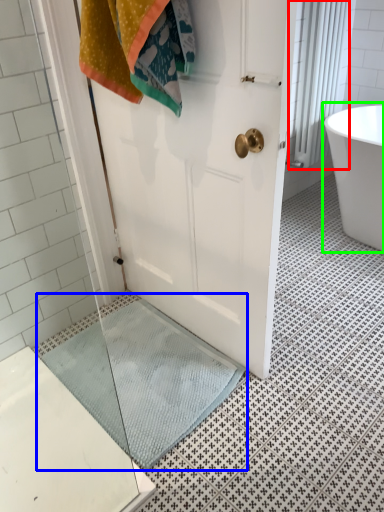
Question: Which object is the farthest from shower curtain (highlighted by a red box)? Choose among these: bath mat (highlighted by a blue box) or bathtub (highlighted by a green box).

Choices:
 (A) bath mat
 (B) bathtub

Answer: (A)